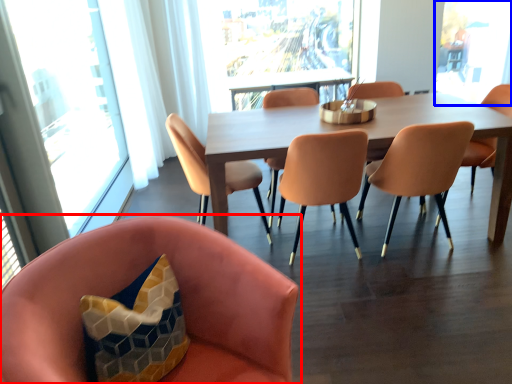
Question: Which point is closer to the camera, chair (highlighted by a red box) or window screen (highlighted by a blue box)?

Choices:
 (A) chair
 (B) window screen

Answer: (A)